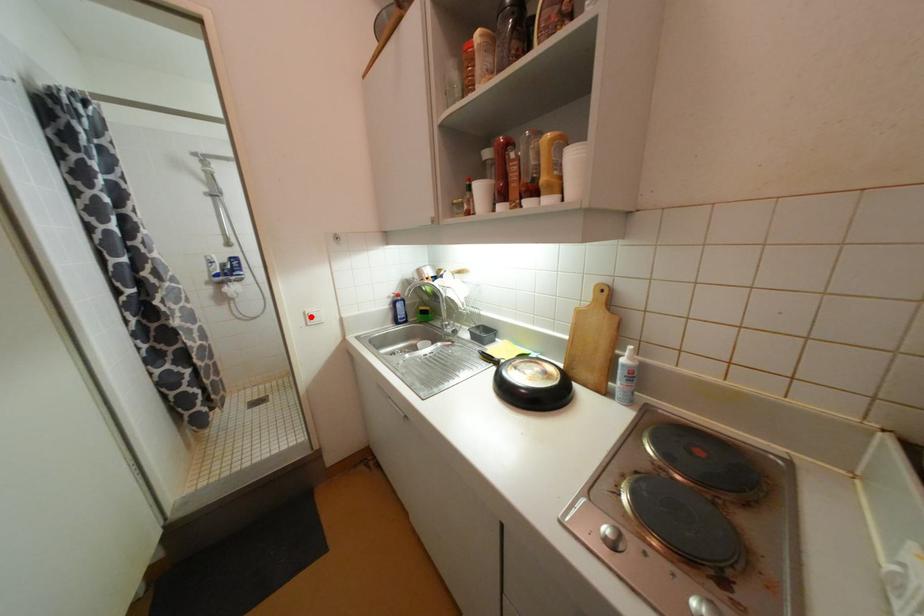
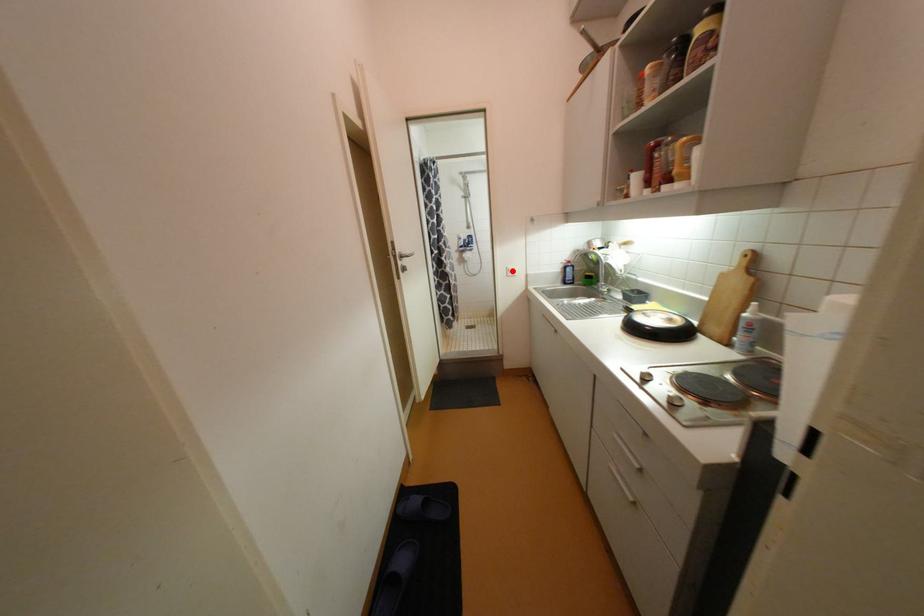
I am providing you with two images of the same scene from different viewpoints. A red point is marked on the first image and another point is marked on the second image. Are the points marked in image1 and image2 representing the same 3D position?

Yes